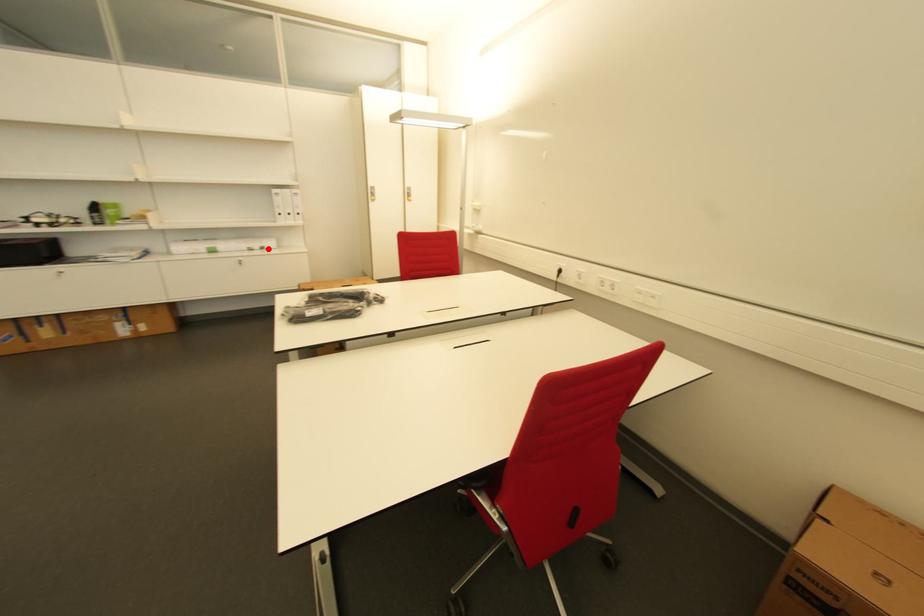
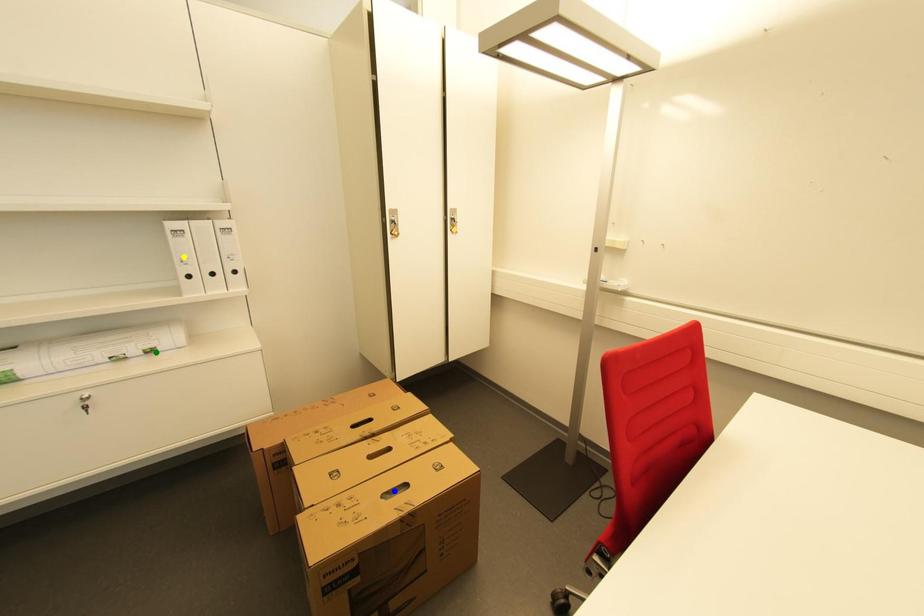
Question: I am providing you with two images of the same scene from different viewpoints. A red point is marked on the first image. You are given multiple points on the second image. Which mark in image 2 goes with the point in image 1?

Choices:
 (A) yellow point
 (B) blue point
 (C) green point

Answer: (C)